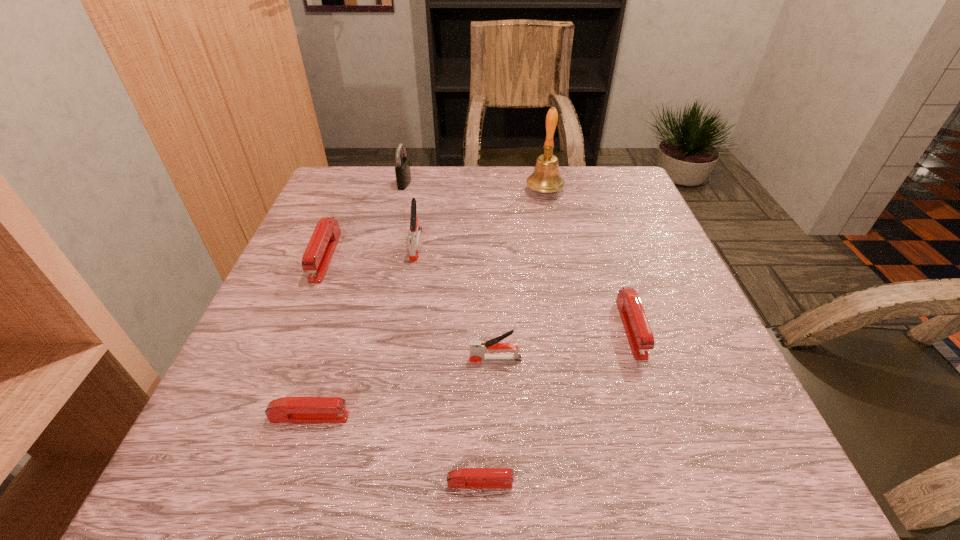
Identify which red stapler is located as the nearest to the rightmost object. Please provide its 2D coordinates. Your answer should be formatted as a tuple, i.e. [(x, y)], where the tuple contains the x and y coordinates of a point satisfying the conditions above.

[(465, 478)]

Point out which red stapler is positioned as the nearest to the second nearest object. Please provide its 2D coordinates. Your answer should be formatted as a tuple, i.e. [(x, y)], where the tuple contains the x and y coordinates of a point satisfying the conditions above.

[(465, 478)]